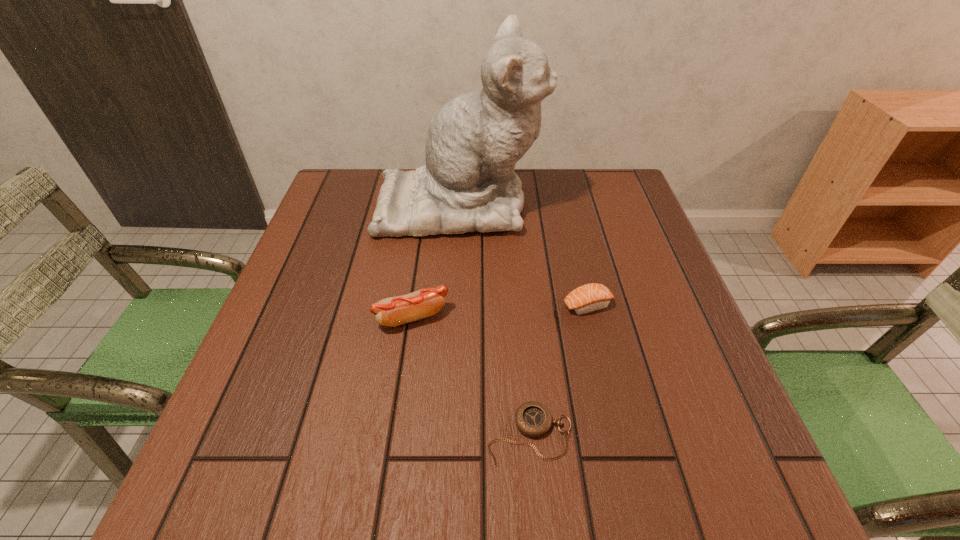
Where is `vacant space that is in between the cat and the sushi`? vacant space that is in between the cat and the sushi is located at coordinates (523, 254).

Find the location of a particular element. This screenshot has height=540, width=960. vacant area between the pocket watch and the third tallest object is located at coordinates pyautogui.click(x=559, y=370).

Image resolution: width=960 pixels, height=540 pixels. Identify the location of vacant space in between the sushi and the tallest object. (523, 254).

Image resolution: width=960 pixels, height=540 pixels. Identify the location of the third closest object to the tallest object. (533, 419).

Identify which object is located as the second nearest to the second tallest object. Please provide its 2D coordinates. Your answer should be formatted as a tuple, i.e. [(x, y)], where the tuple contains the x and y coordinates of a point satisfying the conditions above.

[(474, 141)]

The width and height of the screenshot is (960, 540). Identify the location of vacant space that satisfies the following two spatial constraints: 1. on the front-facing side of the farthest object; 2. on the back side of the third tallest object. click(x=454, y=305).

Find the location of a particular element. free region that satisfies the following two spatial constraints: 1. on the front-facing side of the tallest object; 2. on the front side of the sausage is located at coordinates (453, 317).

You are a GUI agent. You are given a task and a screenshot of the screen. Output one action in this format:
    pyautogui.click(x=<x>, y=<y>)
    Task: Click on the free point that satisfies the following two spatial constraints: 1. on the front-facing side of the cat; 2. on the right side of the sushi
    The image size is (960, 540).
    Given the screenshot: What is the action you would take?
    pyautogui.click(x=454, y=305)

Locate an element on the screen. Image resolution: width=960 pixels, height=540 pixels. vacant space that satisfies the following two spatial constraints: 1. on the front-facing side of the cat; 2. on the back side of the shortest object is located at coordinates (446, 434).

The height and width of the screenshot is (540, 960). What are the coordinates of `blank space that satisfies the following two spatial constraints: 1. on the front-facing side of the tallest object; 2. on the right side of the pocket watch` in the screenshot? It's located at (446, 434).